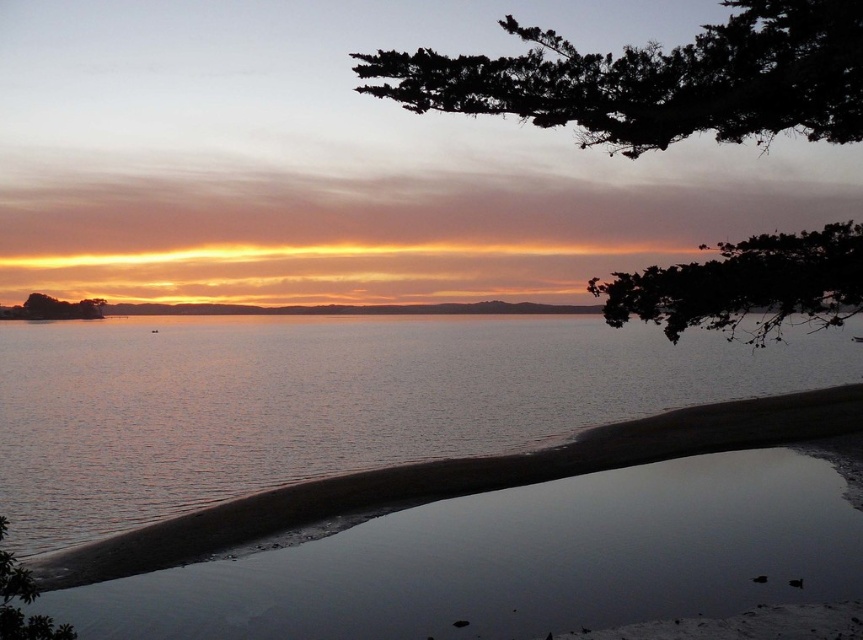
You are standing on the beach and see two points in the scene. The first point is at coordinates point (795, 13) and the second is at point (816, 253). Which point is closer to you?

Point (795, 13) is closer to the camera than point (816, 253), so the first point is closer to you.

You are standing on the beach and looking at the dark green leafy tree at upper center and the dark green leafy branch at upper right. Which one appears taller in the sunset scene?

The dark green leafy tree at upper center appears taller than the dark green leafy branch at upper right in the sunset scene.